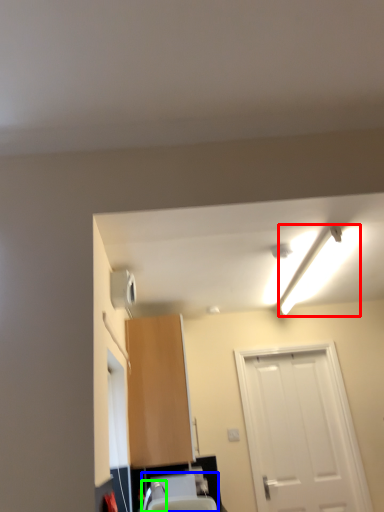
Question: Considering the real-world distances, which object is farthest from light fixture (highlighted by a red box)? sink (highlighted by a blue box) or faucet (highlighted by a green box)?

Choices:
 (A) sink
 (B) faucet

Answer: (B)